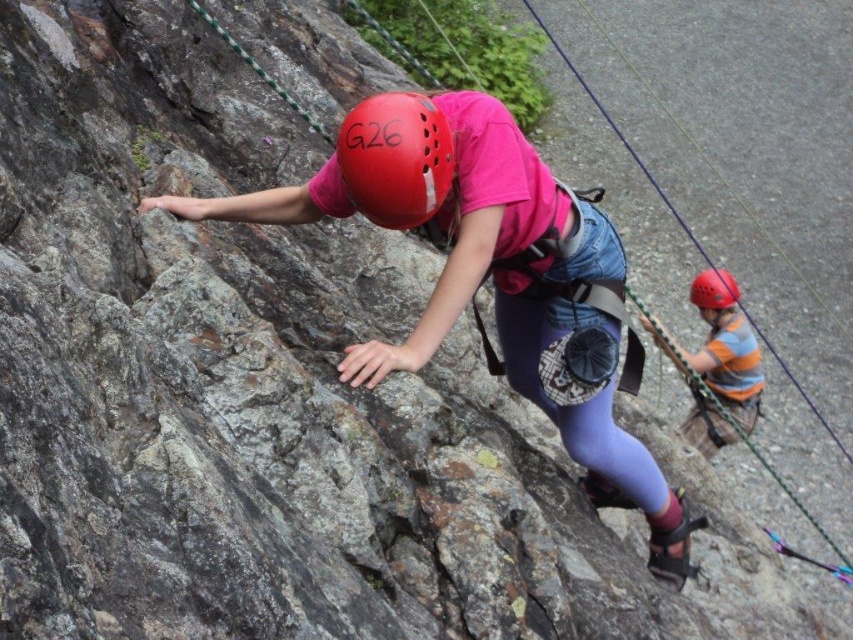
Question: Considering the relative positions of matte red helmet at center and matte red helmet at right in the image provided, where is matte red helmet at center located with respect to matte red helmet at right?

Choices:
 (A) below
 (B) above

Answer: (B)

Question: Among these points, which one is farthest from the camera?

Choices:
 (A) (428, 196)
 (B) (708, 300)

Answer: (B)

Question: Where is matte red helmet at center located in relation to striped cotton shirt at right in the image?

Choices:
 (A) right
 (B) left

Answer: (B)

Question: Is matte pink shirt at center positioned in front of matte red helmet at right?

Choices:
 (A) yes
 (B) no

Answer: (A)

Question: Which of the following is the closest to the observer?

Choices:
 (A) (361, 186)
 (B) (541, 260)
 (C) (703, 291)

Answer: (A)

Question: Which object is closer to the camera taking this photo?

Choices:
 (A) matte red helmet at right
 (B) matte red helmet at center

Answer: (B)